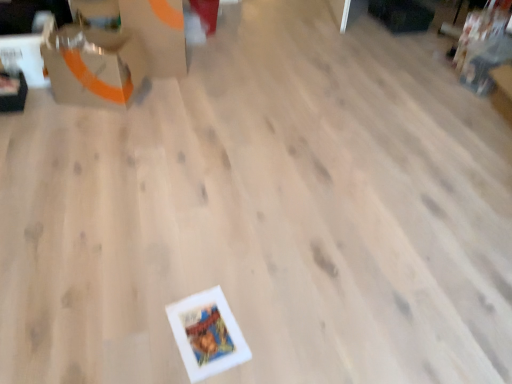
Question: From the image's perspective, would you say matte cardboard box at upper left, the second cardboard box positioned from the top, is shown under matte orange cardboard box at upper left, placed as the 1th cardboard box when sorted from top to bottom?

Choices:
 (A) no
 (B) yes

Answer: (B)

Question: Is the position of matte cardboard box at upper left, which is the 1th cardboard box in bottom-to-top order, less distant than that of matte orange cardboard box at upper left, which is the 2th cardboard box from bottom to top?

Choices:
 (A) yes
 (B) no

Answer: (A)

Question: Does matte cardboard box at upper left, the second cardboard box positioned from the top, contain matte orange cardboard box at upper left, placed as the 1th cardboard box when sorted from top to bottom?

Choices:
 (A) no
 (B) yes

Answer: (A)

Question: Considering the relative sizes of matte cardboard box at upper left, which is the 1th cardboard box in bottom-to-top order, and matte orange cardboard box at upper left, which is the 2th cardboard box from bottom to top, in the image provided, is matte cardboard box at upper left, which is the 1th cardboard box in bottom-to-top order, shorter than matte orange cardboard box at upper left, which is the 2th cardboard box from bottom to top,?

Choices:
 (A) no
 (B) yes

Answer: (B)

Question: Considering the relative sizes of matte cardboard box at upper left, which is the 1th cardboard box in bottom-to-top order, and matte orange cardboard box at upper left, which is the 2th cardboard box from bottom to top, in the image provided, is matte cardboard box at upper left, which is the 1th cardboard box in bottom-to-top order, taller than matte orange cardboard box at upper left, which is the 2th cardboard box from bottom to top,?

Choices:
 (A) yes
 (B) no

Answer: (B)

Question: Is matte orange cardboard box at upper left, which is the 2th cardboard box from bottom to top, at the back of matte cardboard box at upper left, the second cardboard box positioned from the top?

Choices:
 (A) no
 (B) yes

Answer: (B)

Question: Is matte orange cardboard box at upper left, which is the 2th cardboard box from bottom to top, further to the viewer compared to matte cardboard box at upper left, the second cardboard box positioned from the top?

Choices:
 (A) yes
 (B) no

Answer: (A)

Question: From the image's perspective, is matte orange cardboard box at upper left, which is the 2th cardboard box from bottom to top, beneath matte cardboard box at upper left, the second cardboard box positioned from the top?

Choices:
 (A) no
 (B) yes

Answer: (A)

Question: Is matte orange cardboard box at upper left, which is the 2th cardboard box from bottom to top, taller than matte cardboard box at upper left, which is the 1th cardboard box in bottom-to-top order?

Choices:
 (A) yes
 (B) no

Answer: (A)

Question: Is matte orange cardboard box at upper left, placed as the 1th cardboard box when sorted from top to bottom, shorter than matte cardboard box at upper left, the second cardboard box positioned from the top?

Choices:
 (A) no
 (B) yes

Answer: (A)

Question: Does matte orange cardboard box at upper left, which is the 2th cardboard box from bottom to top, have a smaller size compared to matte cardboard box at upper left, which is the 1th cardboard box in bottom-to-top order?

Choices:
 (A) no
 (B) yes

Answer: (A)

Question: Can you confirm if matte orange cardboard box at upper left, placed as the 1th cardboard box when sorted from top to bottom, is bigger than matte cardboard box at upper left, the second cardboard box positioned from the top?

Choices:
 (A) no
 (B) yes

Answer: (B)

Question: Do you think matte cardboard box at upper left, the second cardboard box positioned from the top, is within matte orange cardboard box at upper left, which is the 2th cardboard box from bottom to top, or outside of it?

Choices:
 (A) inside
 (B) outside

Answer: (B)